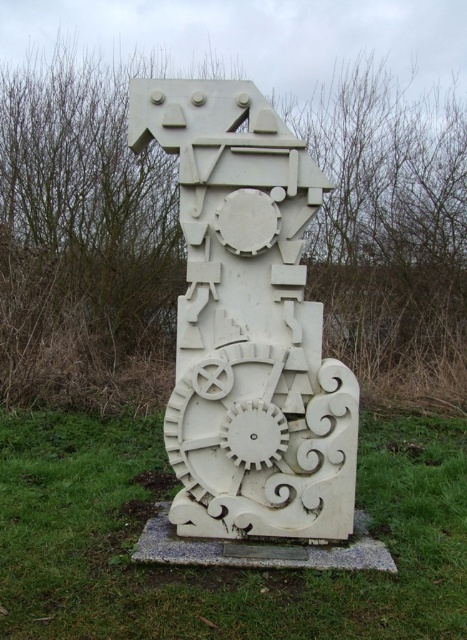
Measure the distance between white carved gear at center and white marble sculpture at center.

white carved gear at center is 5.25 feet away from white marble sculpture at center.

Does white carved gear at center have a smaller size compared to white marble sculpture at center?

Actually, white carved gear at center might be larger than white marble sculpture at center.

You are a GUI agent. You are given a task and a screenshot of the screen. Output one action in this format:
    pyautogui.click(x=<x>, y=<y>)
    Task: Click on the white carved gear at center
    The height and width of the screenshot is (640, 467).
    Given the screenshot: What is the action you would take?
    pyautogui.click(x=219, y=566)